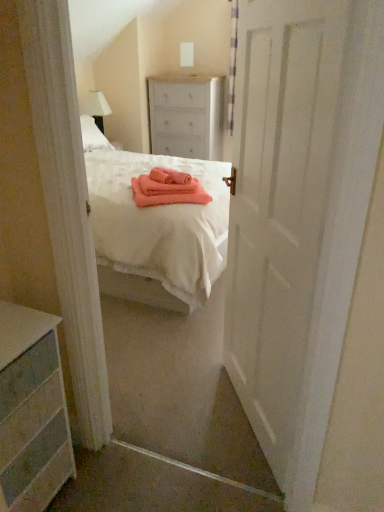
The height and width of the screenshot is (512, 384). I want to click on white fabric lampshade at upper left, so click(x=96, y=106).

In order to face white fabric lampshade at upper left, should I rotate leftwards or rightwards?

It's best to rotate left around 12.260 degrees.

I want to click on white painted wood chest of drawers at center, which is the 2th chest of drawers from left to right, so pos(186,117).

The height and width of the screenshot is (512, 384). Describe the element at coordinates (299, 216) in the screenshot. I see `white matte door at center` at that location.

What do you see at coordinates (169, 176) in the screenshot? I see `pink fabric at center` at bounding box center [169, 176].

Where is `white fabric lampshade at upper left`? white fabric lampshade at upper left is located at coordinates (96, 106).

This screenshot has height=512, width=384. I want to click on door located above the pink fabric at center (from a real-world perspective), so click(299, 216).

Is white matte door at center turned away from pink fabric at center?

No, white matte door at center is not facing away from pink fabric at center.

Which of these two, white matte door at center or pink fabric at center, is smaller?

Smaller between the two is pink fabric at center.

Locate an element on the screen. The width and height of the screenshot is (384, 512). the 1st chest of drawers to the right of the white fabric lampshade at upper left, starting your count from the anchor is located at coordinates (32, 410).

Based on the photo, does white painted wood dresser at lower left, the 1th chest of drawers positioned from the bottom, appear on the right side of white fabric lampshade at upper left?

Yes.

Is white painted wood dresser at lower left, marked as the second chest of drawers in a right-to-left arrangement, not inside white fabric lampshade at upper left?

Absolutely, white painted wood dresser at lower left, marked as the second chest of drawers in a right-to-left arrangement, is external to white fabric lampshade at upper left.

Can you tell me how much white fabric lampshade at upper left and white painted wood chest of drawers at center, which appears as the second chest of drawers when viewed from the front, differ in facing direction?

They differ by 90 degrees in their facing directions.

From the picture: Does white fabric lampshade at upper left have a lesser width compared to white painted wood chest of drawers at center, positioned as the 1th chest of drawers in top-to-bottom order?

Indeed, white fabric lampshade at upper left has a lesser width compared to white painted wood chest of drawers at center, positioned as the 1th chest of drawers in top-to-bottom order.

Does white fabric lampshade at upper left appear on the right side of white painted wood chest of drawers at center, arranged as the first chest of drawers when viewed from the right?

In fact, white fabric lampshade at upper left is to the left of white painted wood chest of drawers at center, arranged as the first chest of drawers when viewed from the right.

At what (x,y) coordinates should I click in order to perform the action: click on the chest of drawers that is the 1st object directly below the white fabric lampshade at upper left (from a real-world perspective). Please return your answer as a coordinate pair (x, y). The image size is (384, 512). Looking at the image, I should click on (186, 117).

Between white fabric lampshade at upper left and white matte door at center, which one has larger width?

white fabric lampshade at upper left.

Considering the relative positions of white fabric lampshade at upper left and white matte door at center in the image provided, is white fabric lampshade at upper left behind white matte door at center?

Yes.

Is white fabric lampshade at upper left directly adjacent to white matte door at center?

They are not placed beside each other.

Which of these two, white fabric lampshade at upper left or white matte door at center, is smaller?

white fabric lampshade at upper left.

Which object is further away from the camera, white painted wood dresser at lower left, the second chest of drawers when ordered from top to bottom, or white matte door at center?

white painted wood dresser at lower left, the second chest of drawers when ordered from top to bottom, is further away from the camera.

What are the coordinates of `the 2nd chest of drawers to the left when counting from the white matte door at center` in the screenshot? It's located at (32, 410).

Does white painted wood dresser at lower left, placed as the second chest of drawers when sorted from back to front, have a smaller size compared to white matte door at center?

Yes, white painted wood dresser at lower left, placed as the second chest of drawers when sorted from back to front, is smaller than white matte door at center.

From the image's perspective, which is above, white painted wood dresser at lower left, the second chest of drawers when ordered from top to bottom, or white matte door at center?

white matte door at center is shown above in the image.

Is white painted wood chest of drawers at center, positioned as the 1th chest of drawers in top-to-bottom order, situated inside white painted wood dresser at lower left, the second chest of drawers when ordered from top to bottom, or outside?

white painted wood chest of drawers at center, positioned as the 1th chest of drawers in top-to-bottom order, is located beyond the bounds of white painted wood dresser at lower left, the second chest of drawers when ordered from top to bottom.

Which of these two, white painted wood chest of drawers at center, which is the 2th chest of drawers from left to right, or white painted wood dresser at lower left, arranged as the first chest of drawers when viewed from the front, is bigger?

white painted wood chest of drawers at center, which is the 2th chest of drawers from left to right, is bigger.

Is white painted wood chest of drawers at center, which is the 2th chest of drawers from left to right, looking in the opposite direction of white painted wood dresser at lower left, the second chest of drawers when ordered from top to bottom?

No, white painted wood chest of drawers at center, which is the 2th chest of drawers from left to right,'s orientation is not away from white painted wood dresser at lower left, the second chest of drawers when ordered from top to bottom.

Looking at this image, would you consider pink fabric at center to be distant from white painted wood chest of drawers at center, which is the 2th chest of drawers from left to right?

pink fabric at center is far away from white painted wood chest of drawers at center, which is the 2th chest of drawers from left to right.

You are a GUI agent. You are given a task and a screenshot of the screen. Output one action in this format:
    pyautogui.click(x=<x>, y=<y>)
    Task: Click on the chest of drawers lying above the pink fabric at center (from the image's perspective)
    Image resolution: width=384 pixels, height=512 pixels.
    Given the screenshot: What is the action you would take?
    pyautogui.click(x=186, y=117)

Between pink fabric at center and white painted wood chest of drawers at center, the second chest of drawers ordered from the bottom, which one has larger size?

With larger size is white painted wood chest of drawers at center, the second chest of drawers ordered from the bottom.

At what (x,y) coordinates should I click in order to perform the action: click on cloth below the white matte door at center (from a real-world perspective). Please return your answer as a coordinate pair (x, y). This screenshot has height=512, width=384. Looking at the image, I should click on (x=169, y=176).

Image resolution: width=384 pixels, height=512 pixels. I want to click on the chest of drawers that appears in front of the white fabric lampshade at upper left, so click(x=32, y=410).

Based on their spatial positions, is white matte door at center or white fabric lampshade at upper left further from white painted wood dresser at lower left, arranged as the first chest of drawers when viewed from the front?

white fabric lampshade at upper left lies further to white painted wood dresser at lower left, arranged as the first chest of drawers when viewed from the front, than the other object.

Based on their spatial positions, is white fabric lampshade at upper left or white matte door at center closer to white painted wood dresser at lower left, the 1th chest of drawers positioned from the bottom?

The object closer to white painted wood dresser at lower left, the 1th chest of drawers positioned from the bottom, is white matte door at center.

Considering their positions, is white matte door at center positioned closer to white painted wood chest of drawers at center, positioned as the 1th chest of drawers in top-to-bottom order, than white painted wood dresser at lower left, placed as the second chest of drawers when sorted from back to front?

white matte door at center.

Looking at the image, which one is located further to white matte door at center, white painted wood chest of drawers at center, which appears as the second chest of drawers when viewed from the front, or pink fabric at center?

Based on the image, white painted wood chest of drawers at center, which appears as the second chest of drawers when viewed from the front, appears to be further to white matte door at center.

Looking at the image, which one is located closer to white painted wood dresser at lower left, the second chest of drawers when ordered from top to bottom, white fabric lampshade at upper left or white painted wood chest of drawers at center, which is the 2th chest of drawers from left to right?

white fabric lampshade at upper left.

Estimate the real-world distances between objects in this image. Which object is closer to white matte door at center, pink fabric at center or white painted wood chest of drawers at center, arranged as the 1th chest of drawers when viewed from the back?

pink fabric at center is positioned closer to the anchor white matte door at center.

In the scene shown: Considering their positions, is white matte door at center positioned closer to white fabric lampshade at upper left than white painted wood chest of drawers at center, arranged as the first chest of drawers when viewed from the right?

white painted wood chest of drawers at center, arranged as the first chest of drawers when viewed from the right, lies closer to white fabric lampshade at upper left than the other object.

Considering their positions, is white painted wood chest of drawers at center, arranged as the 1th chest of drawers when viewed from the back, positioned further to white fabric lampshade at upper left than white matte door at center?

white matte door at center is further to white fabric lampshade at upper left.

Where is `the chest of drawers positioned between white matte door at center and white painted wood chest of drawers at center, which appears as the second chest of drawers when viewed from the front, from near to far`? This screenshot has width=384, height=512. the chest of drawers positioned between white matte door at center and white painted wood chest of drawers at center, which appears as the second chest of drawers when viewed from the front, from near to far is located at coordinates (32, 410).

Locate an element on the screen. The width and height of the screenshot is (384, 512). chest of drawers between white matte door at center and pink fabric at center in the front-back direction is located at coordinates (32, 410).

Find the location of `cloth between white matte door at center and white fabric lampshade at upper left from front to back`. cloth between white matte door at center and white fabric lampshade at upper left from front to back is located at coordinates (169, 176).

Find the location of `lamp between pink fabric at center and white painted wood chest of drawers at center, arranged as the 1th chest of drawers when viewed from the back, from front to back`. lamp between pink fabric at center and white painted wood chest of drawers at center, arranged as the 1th chest of drawers when viewed from the back, from front to back is located at coordinates (96, 106).